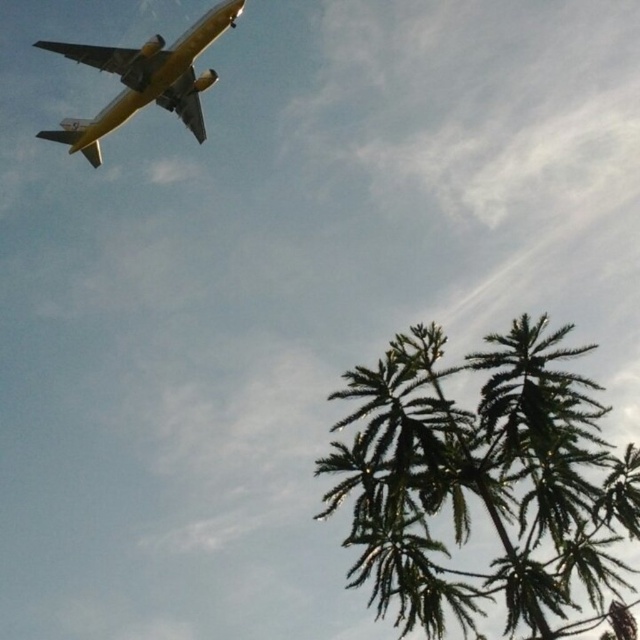
Question: Observing the image, what is the correct spatial positioning of green textured palm tree at lower right in reference to yellow matte airplane at upper left?

Choices:
 (A) below
 (B) above

Answer: (A)

Question: Among these objects, which one is farthest from the camera?

Choices:
 (A) yellow matte airplane at upper left
 (B) green textured palm tree at lower right

Answer: (A)

Question: Which point is closer to the camera taking this photo?

Choices:
 (A) (196, 129)
 (B) (582, 420)

Answer: (B)

Question: Can you confirm if green textured palm tree at lower right is positioned to the left of yellow matte airplane at upper left?

Choices:
 (A) no
 (B) yes

Answer: (A)

Question: Is green textured palm tree at lower right bigger than yellow matte airplane at upper left?

Choices:
 (A) yes
 (B) no

Answer: (A)